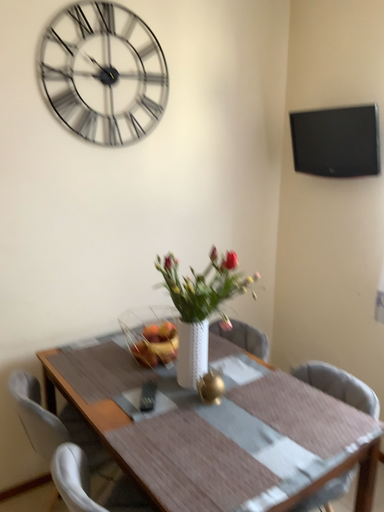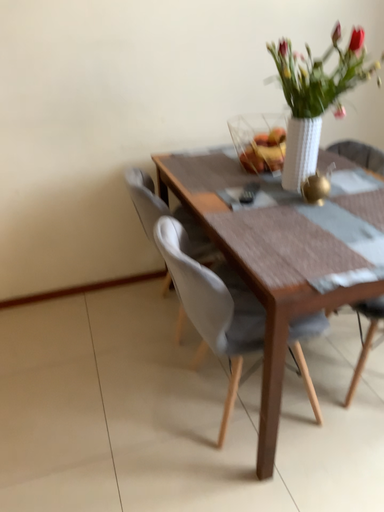
Question: How did the camera likely rotate when shooting the video?

Choices:
 (A) rotated upward
 (B) rotated downward

Answer: (B)